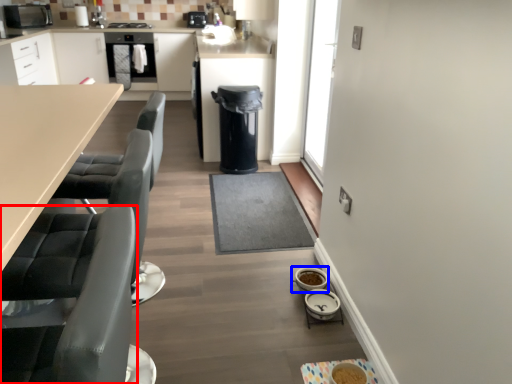
Question: Which object appears closest to the camera in this image, swivel chair (highlighted by a red box) or appliance (highlighted by a blue box)?

Choices:
 (A) swivel chair
 (B) appliance

Answer: (A)